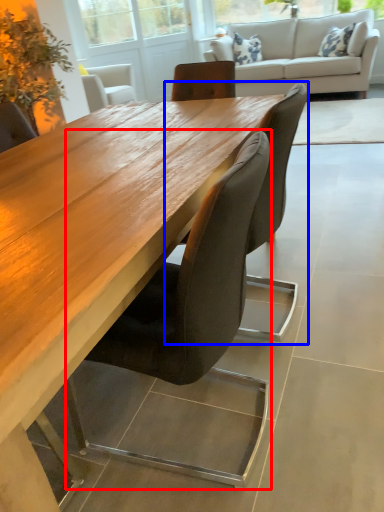
Question: Which object is further to the camera taking this photo, chair (highlighted by a red box) or chair (highlighted by a blue box)?

Choices:
 (A) chair
 (B) chair

Answer: (B)